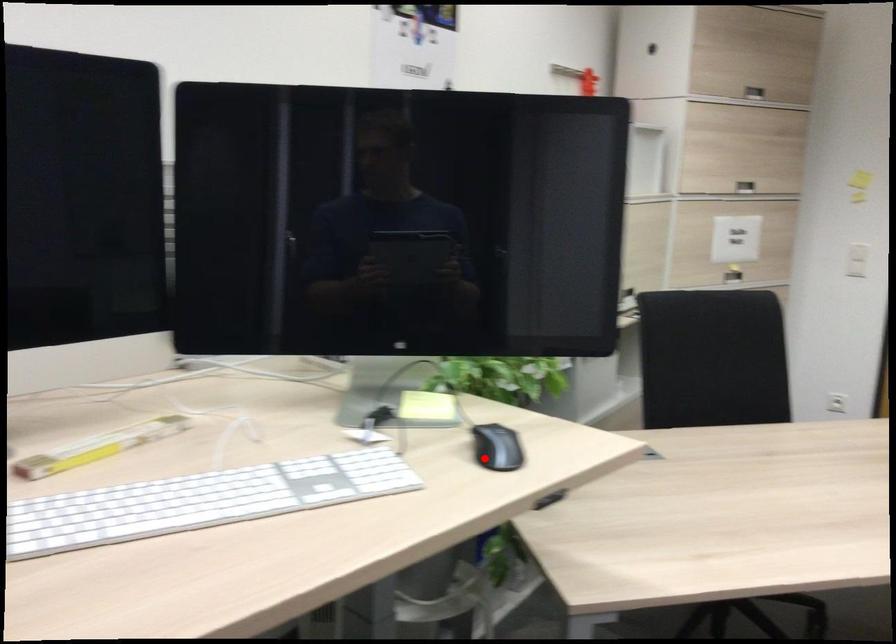
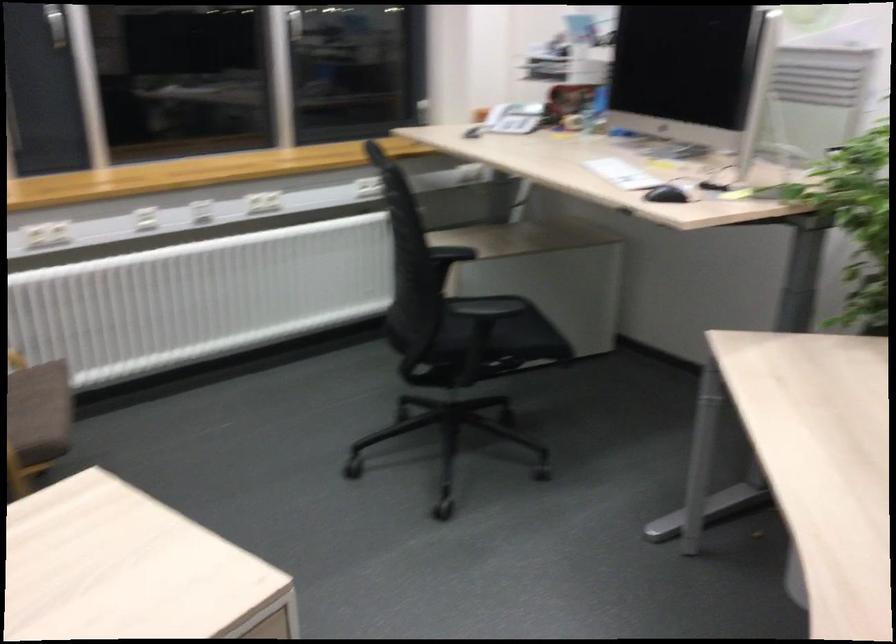
Locate, in the second image, the point that corresponds to the highlighted location in the first image.

(666, 194)